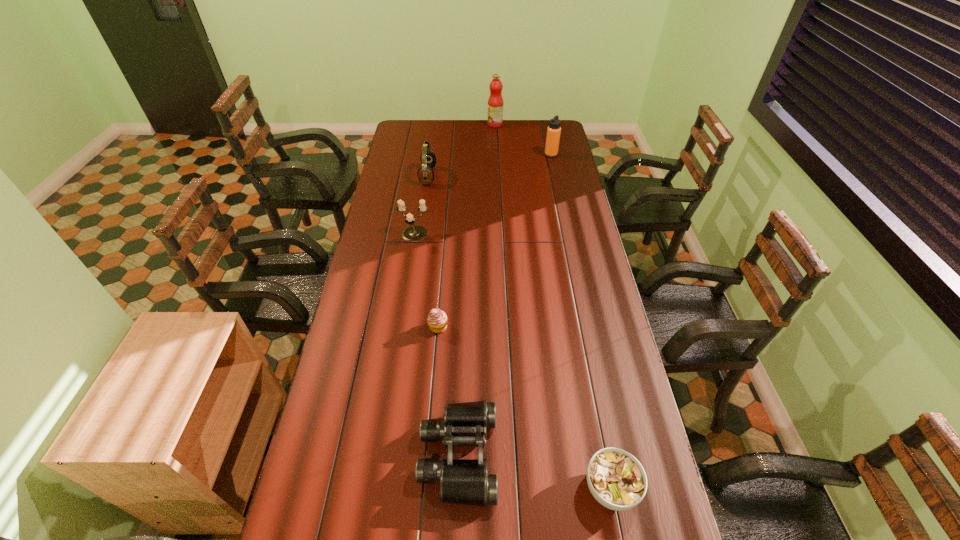
I want to click on free space that satisfies the following two spatial constraints: 1. on the ear cups of the headset; 2. on the back side of the cupcake, so click(406, 327).